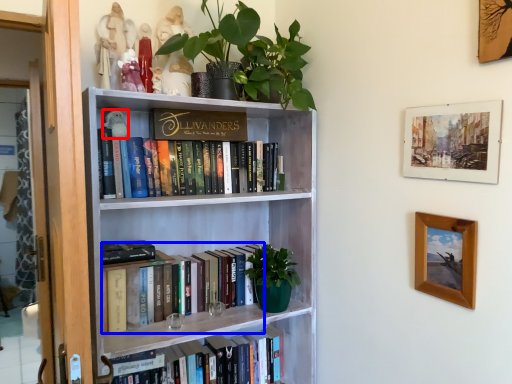
Question: Which of the following is the closest to the observer, toy (highlighted by a red box) or book (highlighted by a blue box)?

Choices:
 (A) toy
 (B) book

Answer: (B)